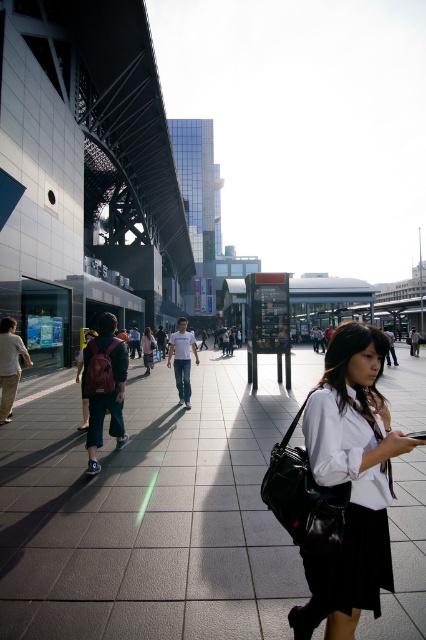
You are a pedestrian standing at the edge of the plaza. You notice the gray tile pavement at center and the white shirt at center. Which object is closer to your eye level?

The white shirt at center is closer to your eye level because it is taller than the gray tile pavement at center.